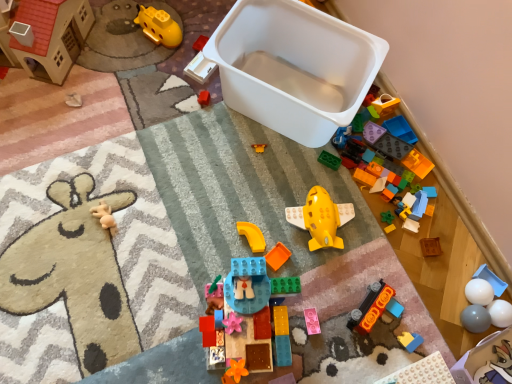
Find the location of a particular element. The height and width of the screenshot is (384, 512). free point in front of white glossy ball at lower right, the fifteenth toy in the left-to-right sequence is located at coordinates (462, 352).